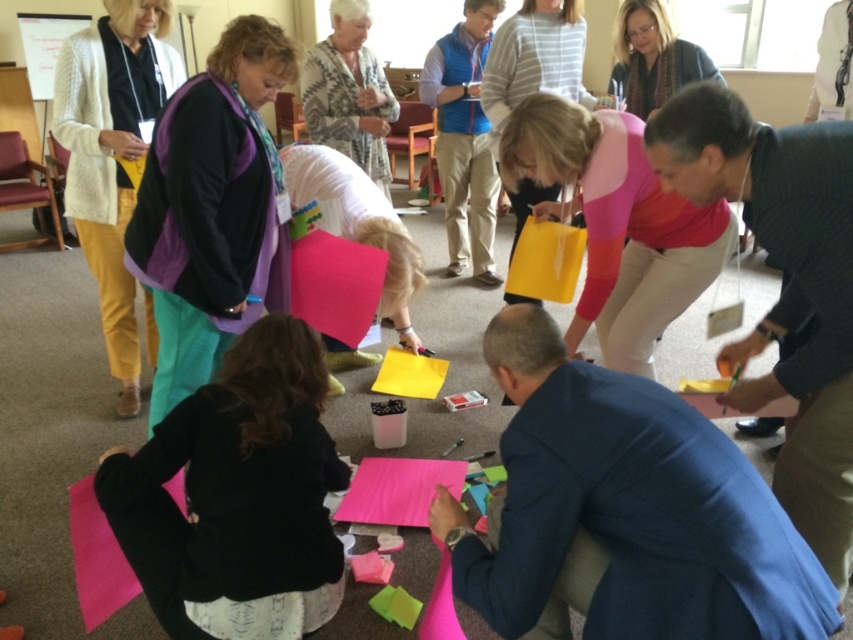
Is pink fabric at center further to the viewer compared to matte white sweater at upper left?

No, it is not.

Between pink fabric at center and matte white sweater at upper left, which one has less height?

pink fabric at center is shorter.

Identify the location of pink fabric at center. (618, 224).

The image size is (853, 640). Identify the location of pink fabric at center. (618, 224).

Which is behind, point (138, 536) or point (392, 516)?

Point (392, 516)

Based on the photo, who is higher up, black fabric at lower center or pink textured paper at lower center?

black fabric at lower center

Locate an element on the screen. black fabric at lower center is located at coordinates (236, 497).

At what (x,y) coordinates should I click in order to perform the action: click on black fabric at lower center. Please return your answer as a coordinate pair (x, y). Image resolution: width=853 pixels, height=640 pixels. Looking at the image, I should click on (236, 497).

Which is below, patterned sweater at upper center or pink textured paper at lower center?

Positioned lower is pink textured paper at lower center.

Measure the distance between point (384, 136) and camera.

14.87 feet

Is point (326, 88) farther from camera compared to point (421, 472)?

Yes, it is.

Where is `patterned sweater at upper center`? patterned sweater at upper center is located at coordinates (349, 92).